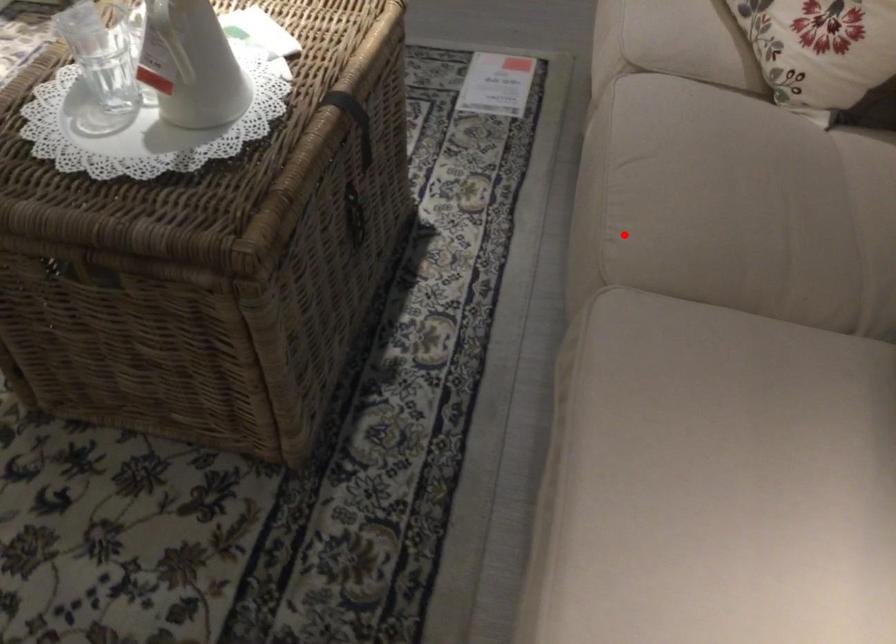
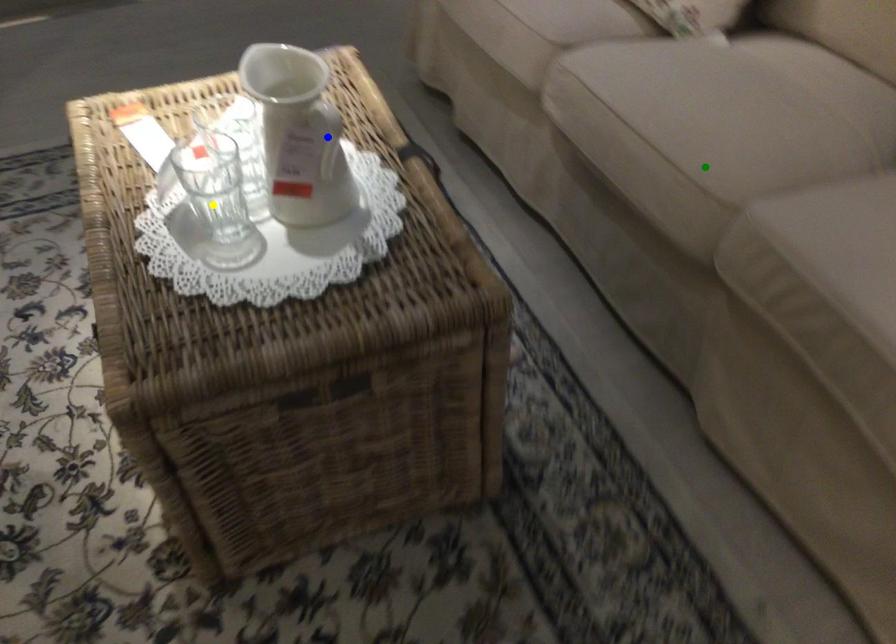
Question: I am providing you with two images of the same scene from different viewpoints. A red point is marked on the first image. You are given multiple points on the second image. Which spot in image 2 lines up with the point in image 1?

Choices:
 (A) blue point
 (B) yellow point
 (C) green point

Answer: (C)